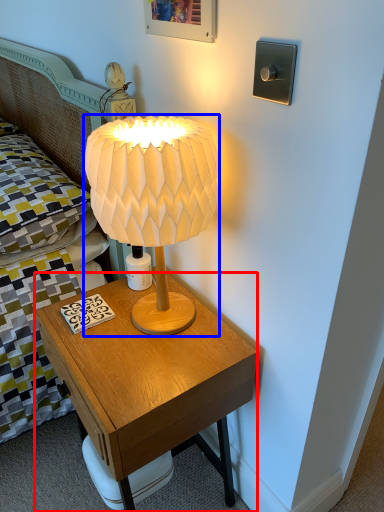
Question: Which point is closer to the camera, nightstand (highlighted by a red box) or lamp (highlighted by a blue box)?

Choices:
 (A) nightstand
 (B) lamp

Answer: (B)